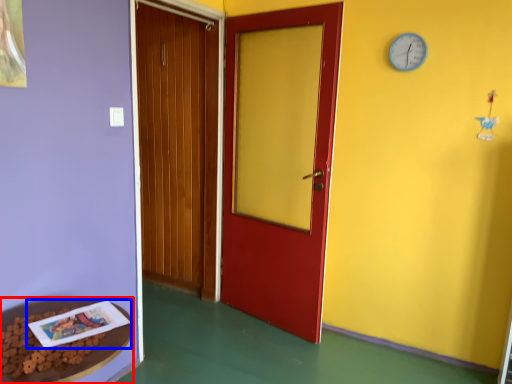
Question: Which point is further to the camera, table (highlighted by a red box) or book (highlighted by a blue box)?

Choices:
 (A) table
 (B) book

Answer: (B)